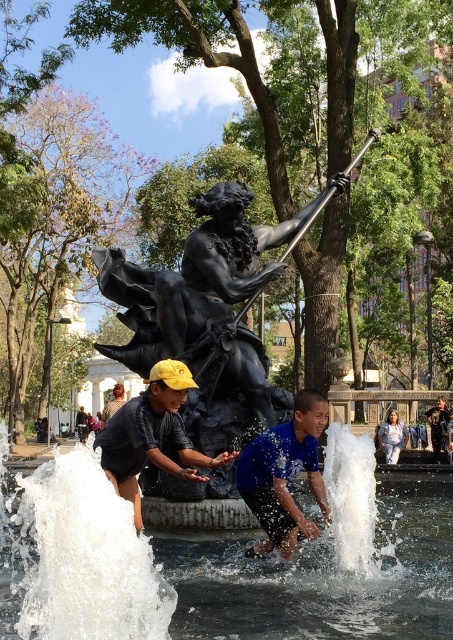
Question: In this image, where is clear water at fountain center located relative to black polished statue at center?

Choices:
 (A) left
 (B) right

Answer: (B)

Question: Is clear water at fountain center thinner than black polished statue at center?

Choices:
 (A) no
 (B) yes

Answer: (A)

Question: Can you confirm if clear water at fountain center is positioned to the right of black polished statue at center?

Choices:
 (A) yes
 (B) no

Answer: (A)

Question: Estimate the real-world distances between objects in this image. Which object is closer to the blue matte shirt at center?

Choices:
 (A) matte black statue at center
 (B) black polished statue at center

Answer: (A)

Question: Considering the real-world distances, which object is closest to the black polished statue at center?

Choices:
 (A) clear water at fountain center
 (B) matte black statue at center

Answer: (B)

Question: Which point is closer to the camera?

Choices:
 (A) blue matte shirt at center
 (B) black polished statue at center
 (C) clear water at fountain center

Answer: (C)